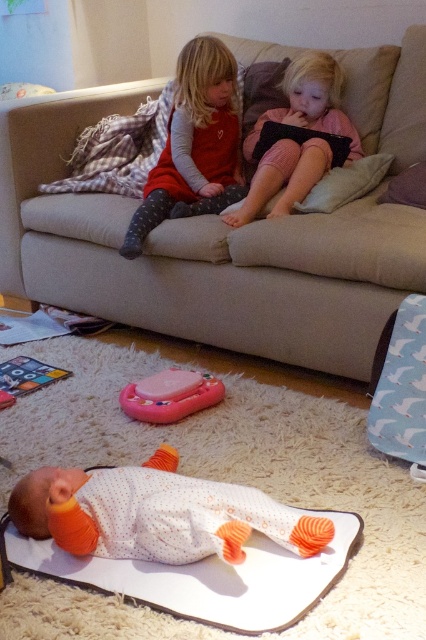
You are a parent trying to retrieve the pink plastic toy at center for your child. The white soft pillow at center is blocking your path. Can you reach the toy without moving the pillow?

The pink plastic toy at center is 37.25 inches away from the white soft pillow at center, so you can reach it without moving the pillow since the distance is sufficient.

You are a parent looking for your child. You see the pink striped leggings at center and the purple fabric pillow at upper right. Which object is closer to the top of the image?

The pink striped leggings at center is located above the purple fabric pillow at upper right, so it is closer to the top of the image.